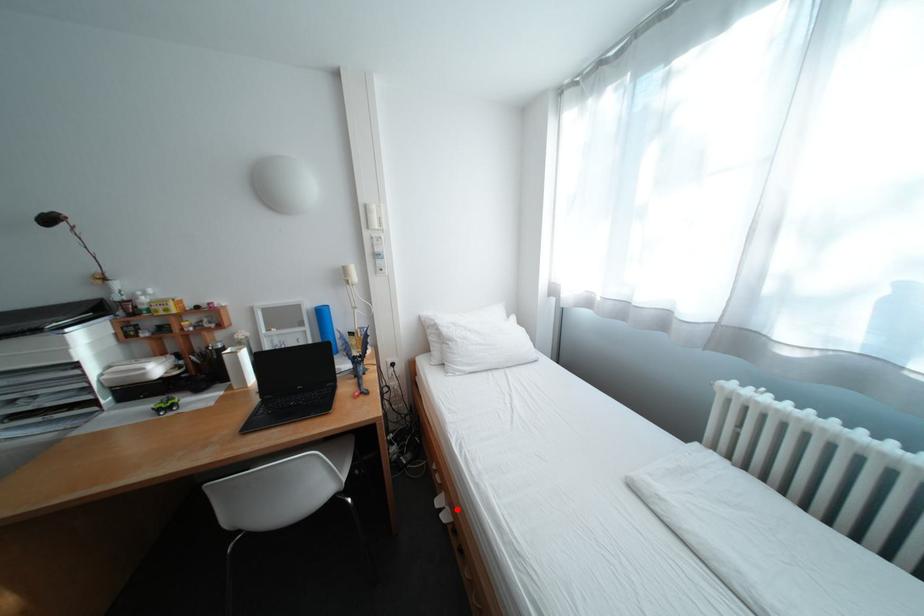
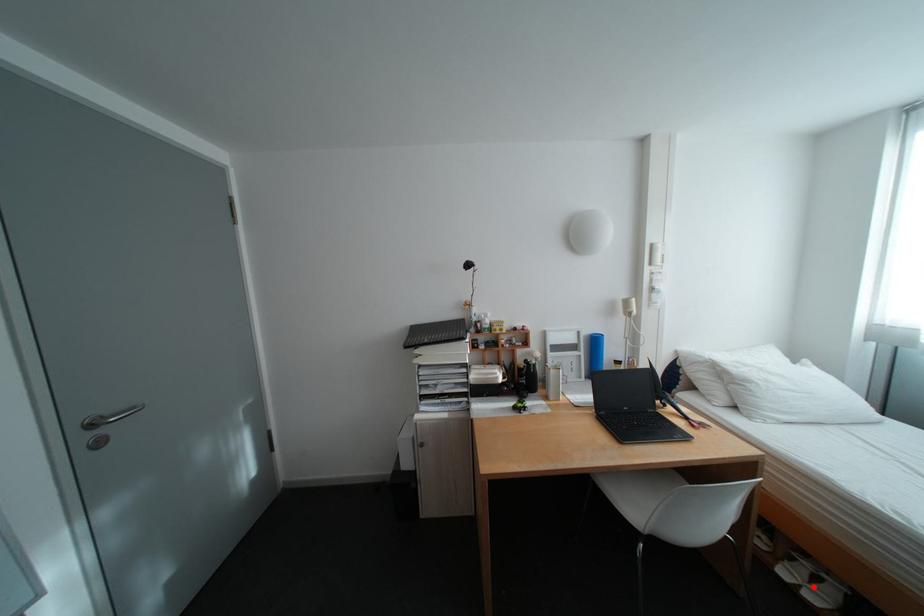
Consider the image. I am providing you with two images of the same scene from different viewpoints. A red point is marked on the first image and another point is marked on the second image. Is the red point in image1 aligned with the point shown in image2?

Yes